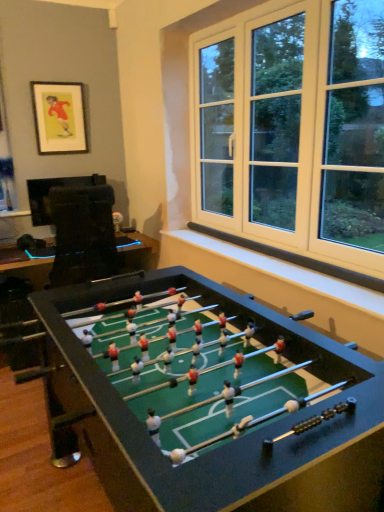
Question: Considering the positions of matte black picture frame at upper left and green felt table at center, the first table in the bottom-to-top sequence, in the image, is matte black picture frame at upper left wider or thinner than green felt table at center, the first table in the bottom-to-top sequence,?

Choices:
 (A) wide
 (B) thin

Answer: (B)

Question: Visually, is matte black picture frame at upper left positioned to the left or to the right of green felt table at center, the second table viewed from the top?

Choices:
 (A) right
 (B) left

Answer: (B)

Question: Which object is positioned farthest from the matte black picture frame at upper left?

Choices:
 (A) green felt table at center, the second table viewed from the top
 (B) black glossy tv at left, positioned as the 1th table in top-to-bottom order

Answer: (A)

Question: Estimate the real-world distances between objects in this image. Which object is farther from the black glossy tv at left, the 2th table from the bottom?

Choices:
 (A) matte black picture frame at upper left
 (B) green felt table at center, the first table in the bottom-to-top sequence

Answer: (B)